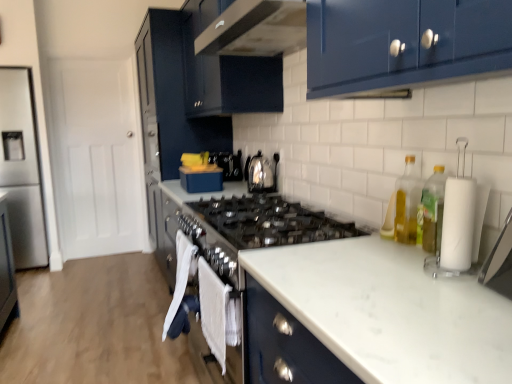
The image size is (512, 384). What do you see at coordinates (407, 203) in the screenshot?
I see `clear glass bottle at right, arranged as the second bottle when viewed from the front` at bounding box center [407, 203].

Where is `clear glass bottle at right, arranged as the second bottle when viewed from the front`? This screenshot has width=512, height=384. clear glass bottle at right, arranged as the second bottle when viewed from the front is located at coordinates (407, 203).

This screenshot has height=384, width=512. What do you see at coordinates (255, 29) in the screenshot? I see `glossy black range hood at upper center` at bounding box center [255, 29].

Measure the distance between point [172,47] and camera.

The distance of point [172,47] from camera is 3.08 meters.

What are the coordinates of `yellow translucent bottle at right, marked as the first bottle in a front-to-back arrangement` in the screenshot? It's located at (432, 207).

Where is `white matte paper towel at right`? This screenshot has height=384, width=512. white matte paper towel at right is located at coordinates (458, 224).

Measure the distance between satin stainless steel refrigerator at left and camera.

satin stainless steel refrigerator at left and camera are 3.70 meters apart.

Identify the location of clear glass bottle at right, the first bottle from the back. (407, 203).

In the image, is satin stainless steel refrigerator at left positioned in front of or behind yellow translucent bottle at right, marked as the first bottle in a front-to-back arrangement?

satin stainless steel refrigerator at left is positioned farther from the viewer than yellow translucent bottle at right, marked as the first bottle in a front-to-back arrangement.

The width and height of the screenshot is (512, 384). I want to click on appliance below the yellow translucent bottle at right, marked as the first bottle in a front-to-back arrangement (from a real-world perspective), so click(x=21, y=168).

Consider the image. Could you tell me if satin stainless steel refrigerator at left is facing yellow translucent bottle at right, placed as the second bottle when sorted from back to front?

No, satin stainless steel refrigerator at left is not turned towards yellow translucent bottle at right, placed as the second bottle when sorted from back to front.

This screenshot has width=512, height=384. In order to click on plain below the clear glass bottle at right, arranged as the second bottle when viewed from the front (from the image's perspective) in this screenshot , I will do `click(94, 325)`.

Who is shorter, clear glass bottle at right, arranged as the second bottle when viewed from the front, or wooden floor at lower left?

Standing shorter between the two is wooden floor at lower left.

Considering the positions of points (416, 202) and (90, 261), is point (416, 202) closer to camera compared to point (90, 261)?

Yes, it is in front of point (90, 261).

Is clear glass bottle at right, arranged as the second bottle when viewed from the front, thinner than wooden floor at lower left?

Indeed, clear glass bottle at right, arranged as the second bottle when viewed from the front, has a lesser width compared to wooden floor at lower left.

Which of these two, white towel at lower center or white matte paper towel at right, is thinner?

With smaller width is white towel at lower center.

Which object is closer to the camera, white towel at lower center or white matte paper towel at right?

white matte paper towel at right is closer to the camera.

Who is smaller, white towel at lower center or white matte paper towel at right?

white matte paper towel at right.

Does point (165, 328) come behind point (444, 251)?

Yes, it is behind point (444, 251).

Are glossy black cabinet at upper center, the 2th cabinetry in the back-to-front sequence, and white marble countertop at center making contact?

No, glossy black cabinet at upper center, the 2th cabinetry in the back-to-front sequence, is not making contact with white marble countertop at center.

From a real-world perspective, is glossy black cabinet at upper center, which ranks as the 1th cabinetry in front-to-back order, on white marble countertop at center?

Correct, in the physical world, glossy black cabinet at upper center, which ranks as the 1th cabinetry in front-to-back order, is higher than white marble countertop at center.

Is glossy black cabinet at upper center, which ranks as the 1th cabinetry in front-to-back order, turned away from white marble countertop at center?

No, glossy black cabinet at upper center, which ranks as the 1th cabinetry in front-to-back order,'s orientation is not away from white marble countertop at center.

From the image's perspective, which object appears higher, glossy black cabinet at upper center, the 2th cabinetry in the back-to-front sequence, or white marble countertop at center?

glossy black cabinet at upper center, the 2th cabinetry in the back-to-front sequence, is shown above in the image.

Would you say yellow translucent bottle at right, placed as the second bottle when sorted from back to front, is inside or outside satin stainless steel refrigerator at left?

yellow translucent bottle at right, placed as the second bottle when sorted from back to front, lies outside satin stainless steel refrigerator at left.

Is point (443, 189) positioned behind point (1, 98)?

No, it is in front of (1, 98).

Which object is closer to the camera, yellow translucent bottle at right, placed as the second bottle when sorted from back to front, or satin stainless steel refrigerator at left?

yellow translucent bottle at right, placed as the second bottle when sorted from back to front, is in front.

From the image's perspective, which is above, yellow translucent bottle at right, marked as the first bottle in a front-to-back arrangement, or satin stainless steel refrigerator at left?

satin stainless steel refrigerator at left.

You are a GUI agent. You are given a task and a screenshot of the screen. Output one action in this format:
    pyautogui.click(x=<x>, y=<y>)
    Task: Click on the appliance behind the white marble countertop at center
    The width and height of the screenshot is (512, 384).
    Given the screenshot: What is the action you would take?
    pyautogui.click(x=21, y=168)

Would you say white marble countertop at center is outside satin stainless steel refrigerator at left?

white marble countertop at center lies outside satin stainless steel refrigerator at left's area.

Does white marble countertop at center lie in front of satin stainless steel refrigerator at left?

That is True.

Considering the sizes of white marble countertop at center and satin stainless steel refrigerator at left in the image, is white marble countertop at center taller or shorter than satin stainless steel refrigerator at left?

white marble countertop at center is shorter than satin stainless steel refrigerator at left.

Is glossy dark blue cabinet at center, which appears as the 1th cabinetry when viewed from the back, turned away from satin silver toaster at center?

glossy dark blue cabinet at center, which appears as the 1th cabinetry when viewed from the back, does not have its back to satin silver toaster at center.

Are glossy dark blue cabinet at center, the second cabinetry from the front, and satin silver toaster at center located far from each other?

Yes, glossy dark blue cabinet at center, the second cabinetry from the front, and satin silver toaster at center are located far from each other.

From the image's perspective, which one is positioned lower, glossy dark blue cabinet at center, the second cabinetry from the front, or satin silver toaster at center?

satin silver toaster at center.

I want to click on kitchen appliance that appears below the glossy dark blue cabinet at center, which appears as the 1th cabinetry when viewed from the back (from a real-world perspective), so click(261, 173).

Locate an element on the screen. appliance located above the yellow translucent bottle at right, placed as the second bottle when sorted from back to front (from the image's perspective) is located at coordinates (21, 168).

Locate an element on the screen. The height and width of the screenshot is (384, 512). plain on the left of the clear glass bottle at right, the first bottle from the back is located at coordinates (94, 325).

Looking at the image, which one is located closer to glossy black range hood at upper center, satin stainless steel refrigerator at left or yellow translucent bottle at right, placed as the second bottle when sorted from back to front?

yellow translucent bottle at right, placed as the second bottle when sorted from back to front, is closer to glossy black range hood at upper center.

Estimate the real-world distances between objects in this image. Which object is further from white matte paper towel at right, glossy dark blue cabinet at center, which appears as the 1th cabinetry when viewed from the back, or glossy black cabinet at upper center, the 2th cabinetry in the back-to-front sequence?

Among the two, glossy dark blue cabinet at center, which appears as the 1th cabinetry when viewed from the back, is located further to white matte paper towel at right.

Estimate the real-world distances between objects in this image. Which object is further from clear glass bottle at right, arranged as the second bottle when viewed from the front, white marble countertop at center or white matte paper towel at right?

Based on the image, white marble countertop at center appears to be further to clear glass bottle at right, arranged as the second bottle when viewed from the front.

Considering their positions, is glossy dark blue cabinet at center, the second cabinetry from the front, positioned closer to yellow translucent bottle at right, placed as the second bottle when sorted from back to front, than satin stainless steel refrigerator at left?

glossy dark blue cabinet at center, the second cabinetry from the front, is positioned closer to the anchor yellow translucent bottle at right, placed as the second bottle when sorted from back to front.

Based on their spatial positions, is satin silver toaster at center or white marble countertop at center closer to yellow translucent bottle at right, marked as the first bottle in a front-to-back arrangement?

white marble countertop at center lies closer to yellow translucent bottle at right, marked as the first bottle in a front-to-back arrangement, than the other object.

Which object lies further to the anchor point satin stainless steel refrigerator at left, glossy dark blue cabinet at center, the second cabinetry from the front, or yellow translucent bottle at right, placed as the second bottle when sorted from back to front?

yellow translucent bottle at right, placed as the second bottle when sorted from back to front.

Which object lies further to the anchor point glossy black range hood at upper center, yellow translucent bottle at right, placed as the second bottle when sorted from back to front, or white matte paper towel at right?

white matte paper towel at right is positioned further to the anchor glossy black range hood at upper center.

Which object lies nearer to the anchor point white matte paper towel at right, white towel at lower center or wooden floor at lower left?

white towel at lower center is positioned closer to the anchor white matte paper towel at right.

Identify the location of cabinetry located between yellow translucent bottle at right, marked as the first bottle in a front-to-back arrangement, and glossy dark blue cabinet at center, the second cabinetry from the front, in the depth direction. The height and width of the screenshot is (384, 512). (225, 71).

The image size is (512, 384). I want to click on plain between white marble countertop at center and glossy dark blue cabinet at center, the second cabinetry from the front, from front to back, so point(94,325).

Identify the location of oven between clear glass bottle at right, arranged as the second bottle when viewed from the front, and satin silver toaster at center in the front-back direction. The width and height of the screenshot is (512, 384). (207, 314).

Identify the location of home appliance that lies between glossy black cabinet at upper center, the 2th cabinetry in the back-to-front sequence, and white marble countertop at center from top to bottom. The height and width of the screenshot is (384, 512). (255, 29).